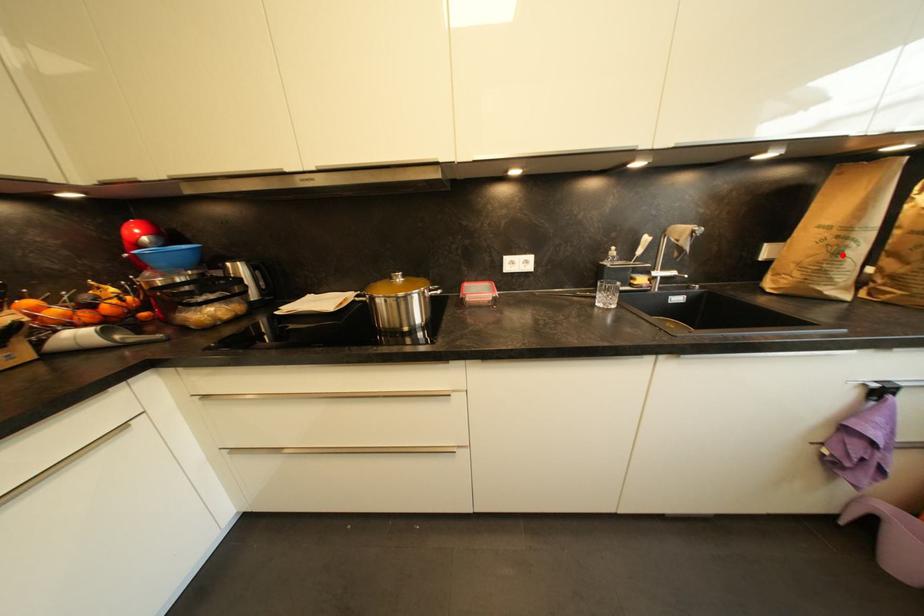
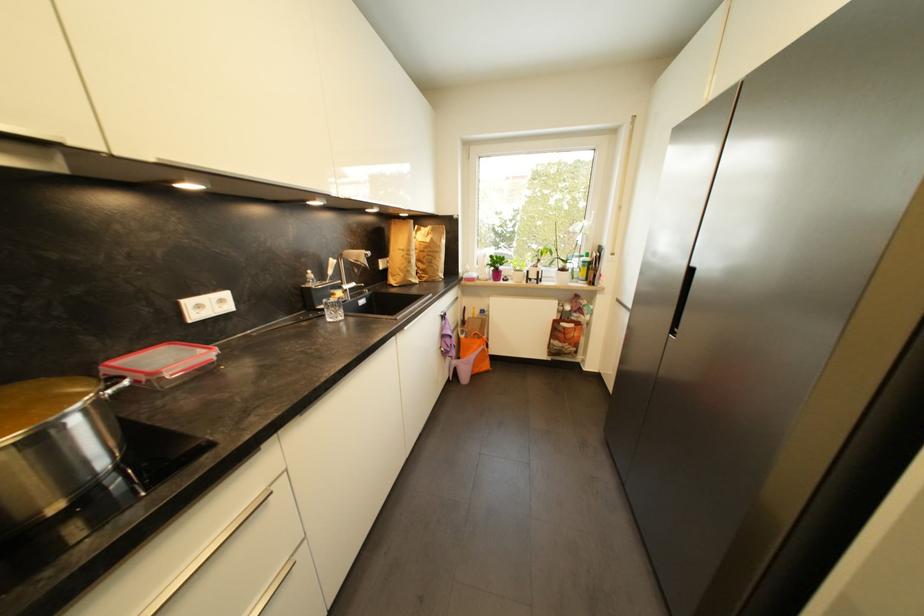
Question: I am providing you with two images of the same scene from different viewpoints. In image1, a red point is highlighted. Considering the same 3D point in image2, which of the following is correct?

Choices:
 (A) It is closer
 (B) It is farther

Answer: (A)